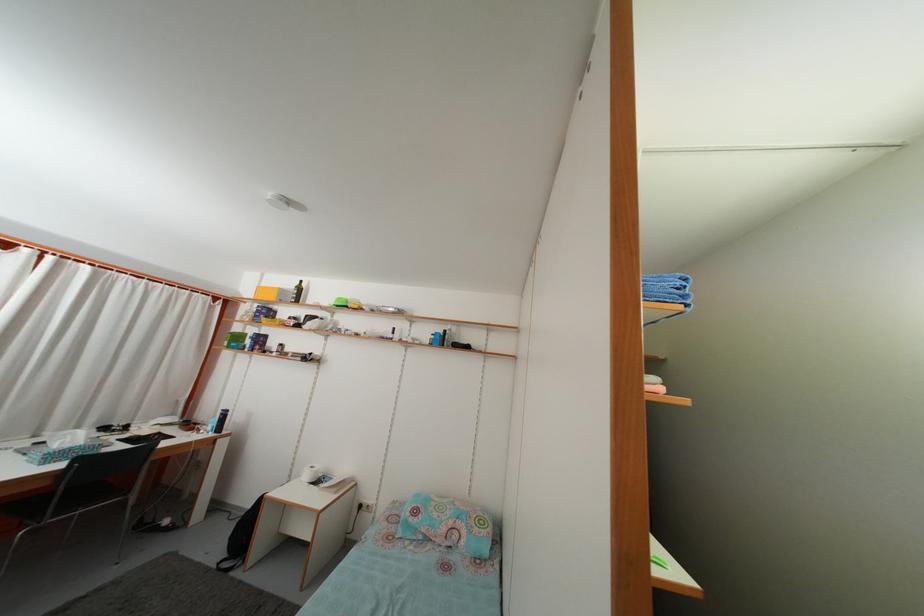
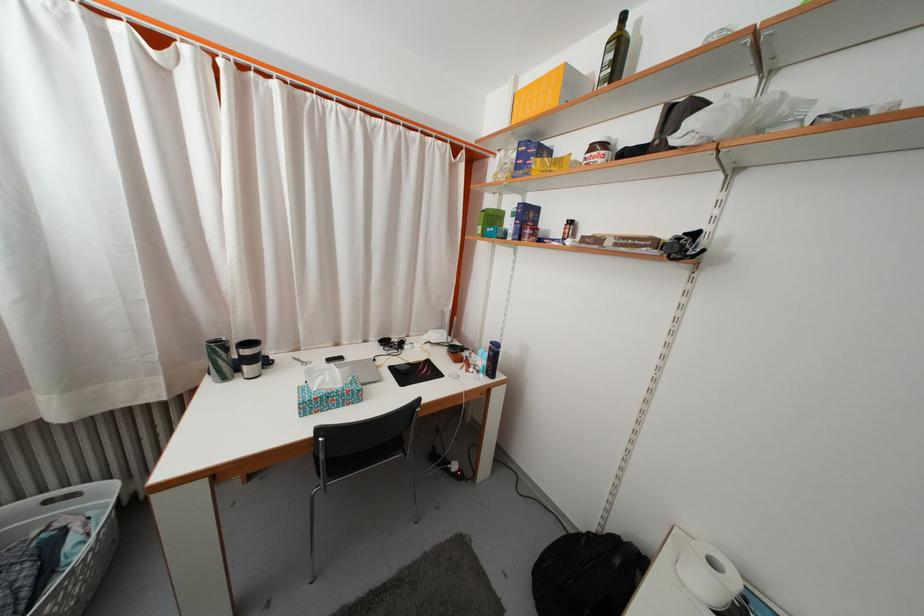
In the second image, find the point that corresponds to (x=286, y=299) in the first image.

(575, 84)